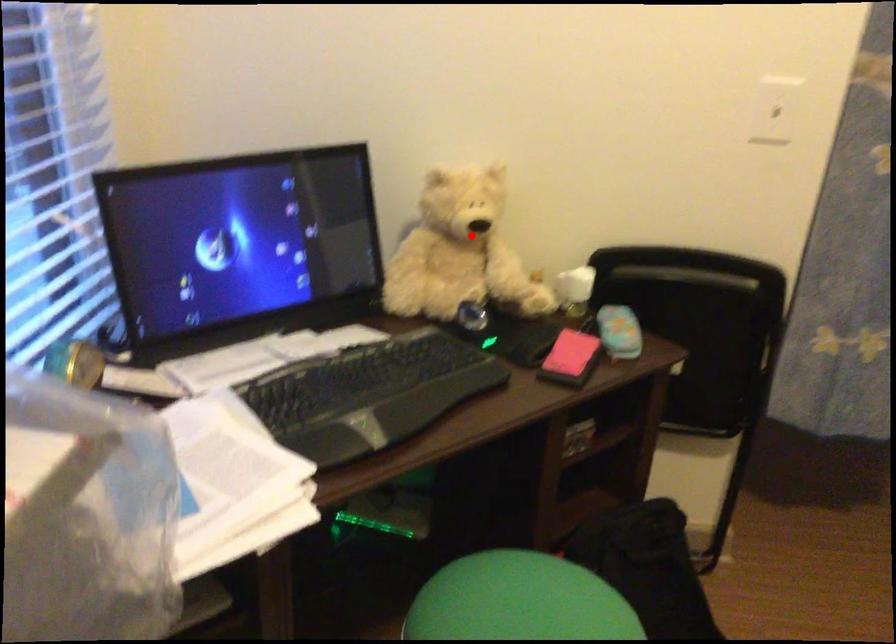
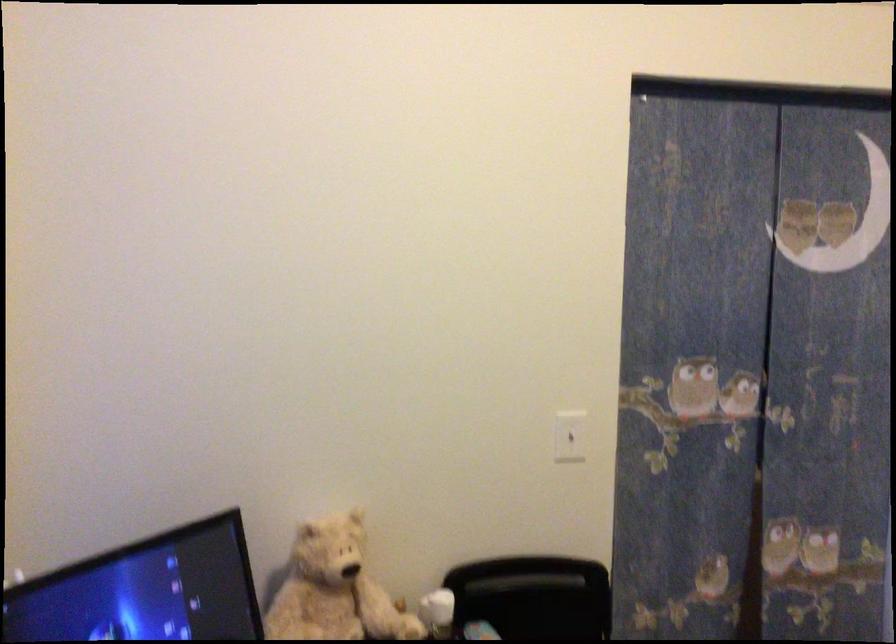
Find the pixel in the second image that matches the highlighted location in the first image.

(334, 589)